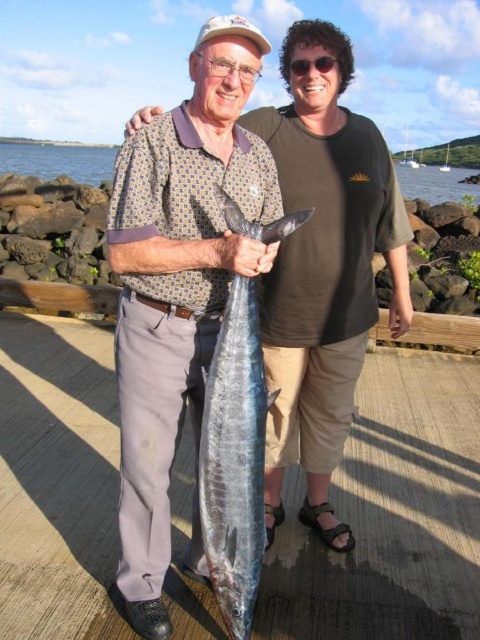
Question: Among these objects, which one is farthest from the camera?

Choices:
 (A) smooth wood dock at center
 (B) shiny blue fish at center
 (C) shiny metallic fish at center

Answer: (A)

Question: Is smooth wood dock at center above shiny metallic fish at center?

Choices:
 (A) yes
 (B) no

Answer: (B)

Question: Which of the following is the closest to the observer?

Choices:
 (A) smooth wood dock at center
 (B) shiny blue fish at center

Answer: (B)

Question: Does smooth wood dock at center have a larger size compared to shiny blue fish at center?

Choices:
 (A) no
 (B) yes

Answer: (B)

Question: Does smooth wood dock at center have a smaller size compared to shiny metallic fish at center?

Choices:
 (A) no
 (B) yes

Answer: (A)

Question: Estimate the real-world distances between objects in this image. Which object is farther from the shiny metallic fish at center?

Choices:
 (A) smooth wood dock at center
 (B) shiny blue fish at center

Answer: (A)